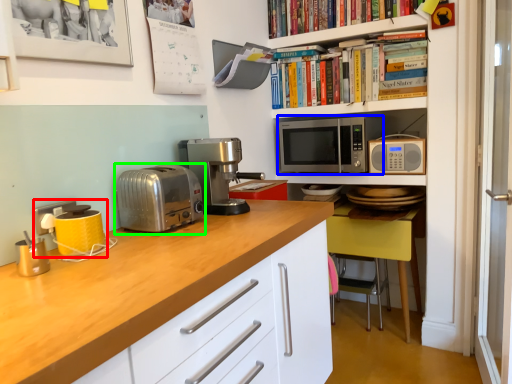
Question: Estimate the real-world distances between objects in this image. Which object is closer to coffee machine (highlighted by a red box), microwave oven (highlighted by a blue box) or toaster (highlighted by a green box)?

Choices:
 (A) microwave oven
 (B) toaster

Answer: (B)